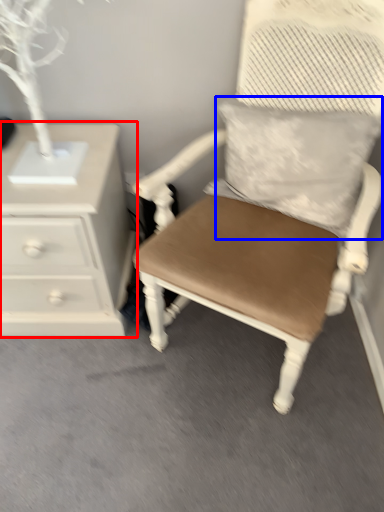
Question: Which point is further to the camera, chest of drawers (highlighted by a red box) or pillow (highlighted by a blue box)?

Choices:
 (A) chest of drawers
 (B) pillow

Answer: (A)